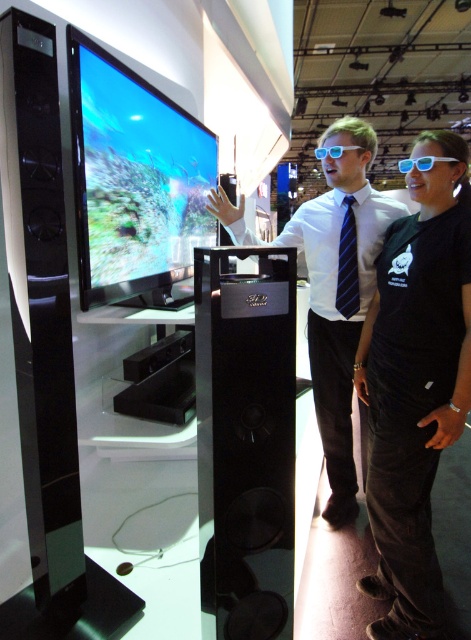
Where is the shiny glossy screen at center located in the scene?

The shiny glossy screen at center is located at point coordinates of (134,179).

You are a photographer at the exhibition and need to capture a clear shot of both the black corduroy pants at lower right and the shiny glossy screen at center. Since the screen is larger, which object should you focus on first to ensure both are in frame?

The black corduroy pants at lower right is smaller than the shiny glossy screen at center. To ensure both are in frame, focus on the larger shiny glossy screen at center first, then adjust the camera angle to include the smaller black corduroy pants at lower right.